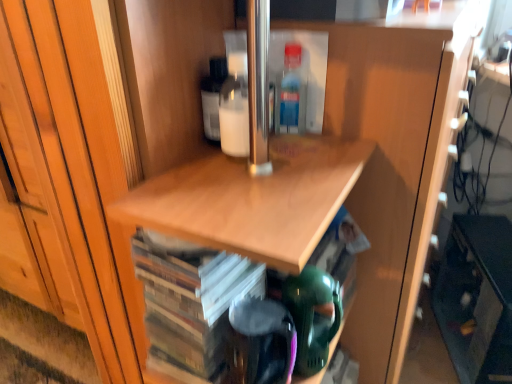
Question: Is translucent plastic bottle at upper center in front of or behind wooden cd case at center in the image?

Choices:
 (A) front
 (B) behind

Answer: (B)

Question: Does point (284, 92) appear closer or farther from the camera than point (154, 304)?

Choices:
 (A) farther
 (B) closer

Answer: (A)

Question: Which object is positioned farthest from the matte black cabinet at lower right?

Choices:
 (A) translucent plastic bottle at upper center
 (B) wooden cd case at center

Answer: (A)

Question: Which is farther from the matte black cabinet at lower right?

Choices:
 (A) wooden cd case at center
 (B) translucent plastic bottle at upper center

Answer: (B)